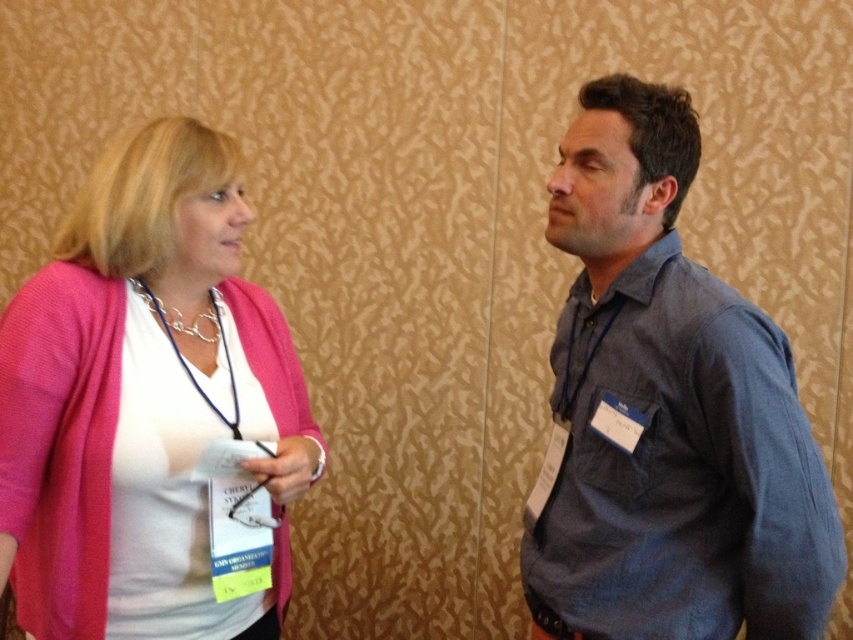
You are a tailor who needs to determine which clothing item requires more fabric to repair. Based on the image, which one needs more fabric, the blue denim shirt at right or the pink fabric sweater at left?

The pink fabric sweater at left requires more fabric for repair since it is larger than the blue denim shirt at right.

You are trying to decide which clothing item to take for a cold day. The blue denim shirt at right and the pink fabric sweater at left are both available. Based on their thickness, which one would be warmer?

The pink fabric sweater at left is thicker than the blue denim shirt at right, so it would be warmer.